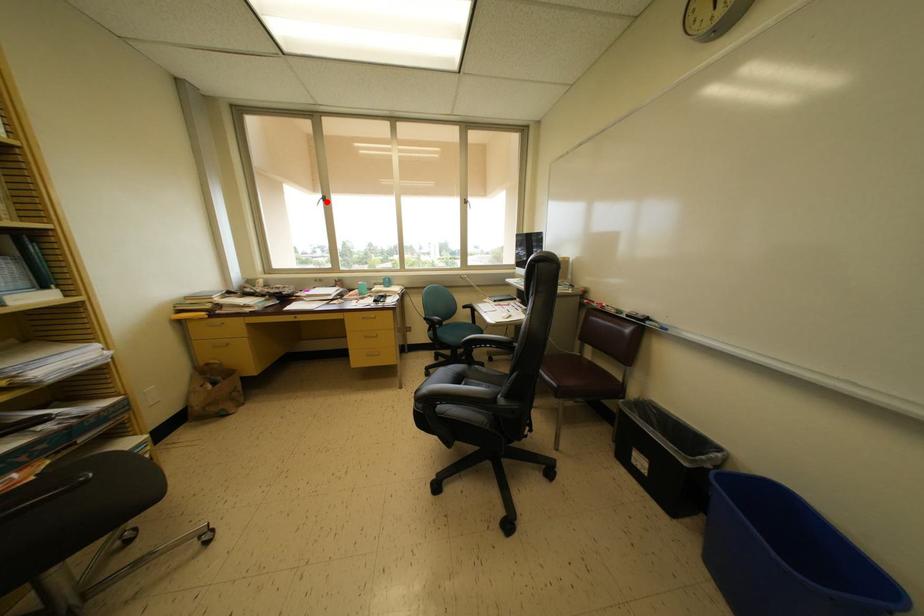
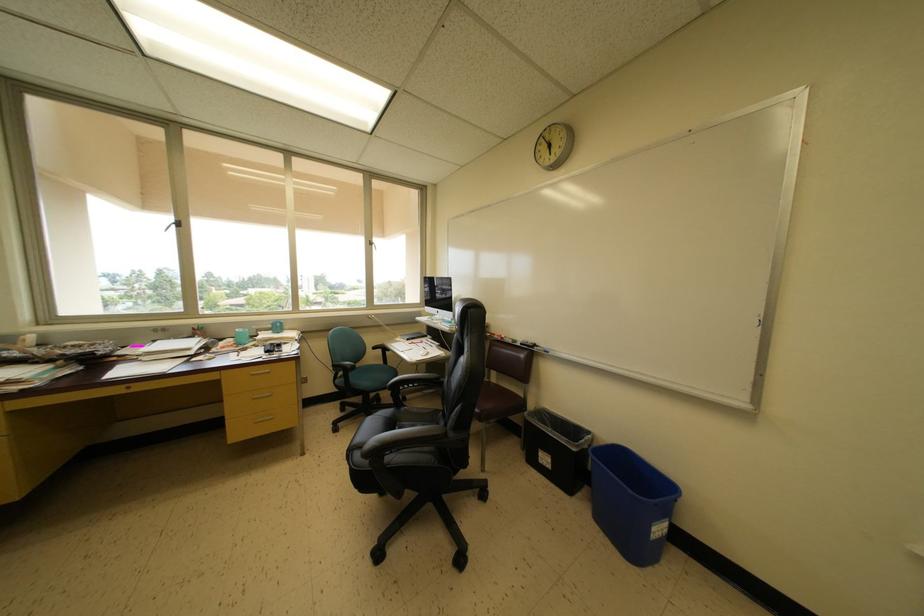
Where in the second image is the point corresponding to the highlighted location from the first image?

(179, 225)